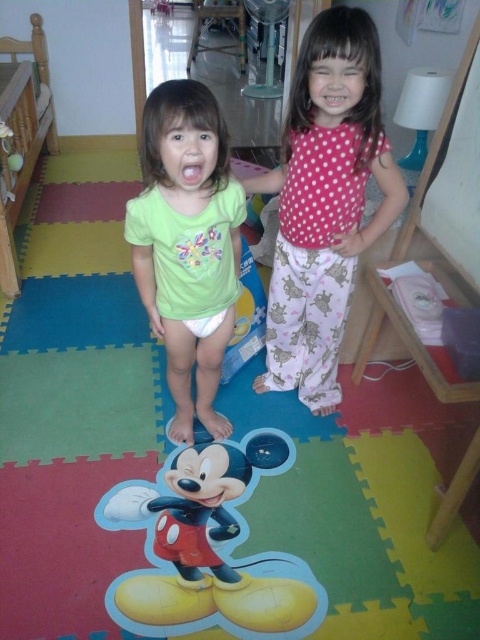
You are standing in the playroom and want to reach the point marked as point (181, 115). If you take a step forward of 3 feet, will you be closer to the point?

The point (181, 115) is 4.12 feet away from you. If you take a step forward of 3 feet, you will be 1.12 feet away from the point, so yes, you will be closer to the point.

You are a photographer setting up a camera at the back of the room. You need to ensure both the pink dotted pajamas at center and the green matte shirt at center are fully visible in the photo. Based on their heights, which child should stand closer to the front to avoid blocking the other?

The pink dotted pajamas at center is much taller than the green matte shirt at center, so the taller child in pink dotted pajamas at center should stand closer to the front to avoid blocking the shorter child in green matte shirt at center.

You are standing in the playroom and want to reach the point marked as point (334, 355). If you can move forward 6.58 feet, will you reach it?

Yes, because the point (334, 355) is exactly 6.58 feet away from the viewer.